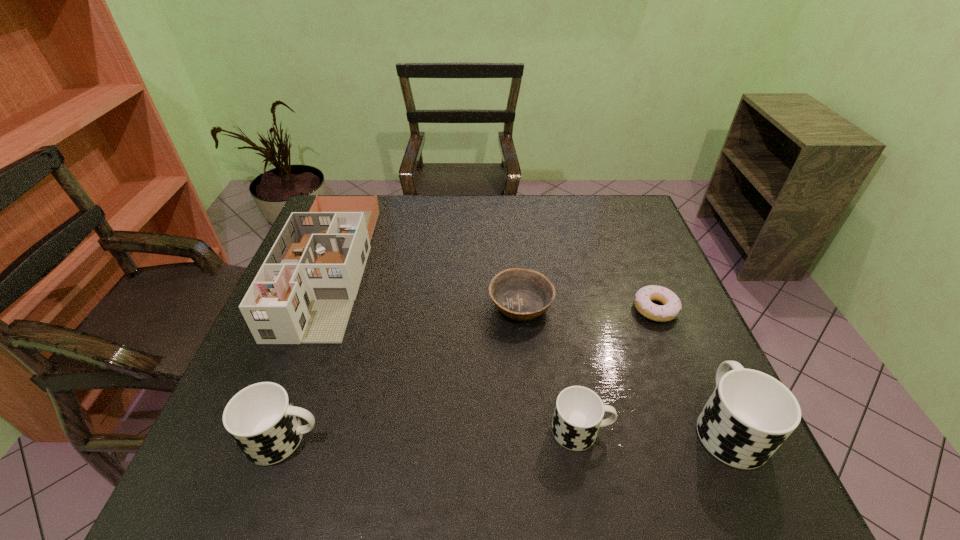
If the aim is uniform spacing by inserting an additional cup among them, please point to a vacant space for this new cup. Please provide its 2D coordinates. Your answer should be formatted as a tuple, i.e. [(x, y)], where the tuple contains the x and y coordinates of a point satisfying the conditions above.

[(434, 435)]